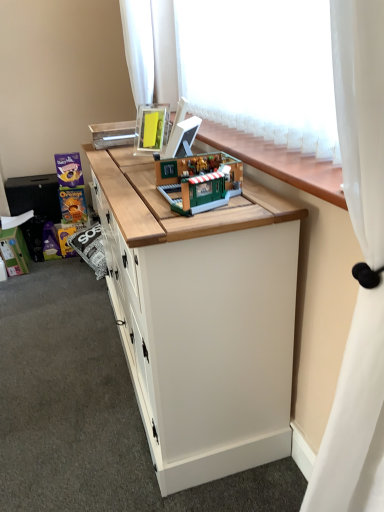
The image size is (384, 512). I want to click on free space on the front side of brick-like green building at center, which is the third toy in left-to-right order, so [198, 219].